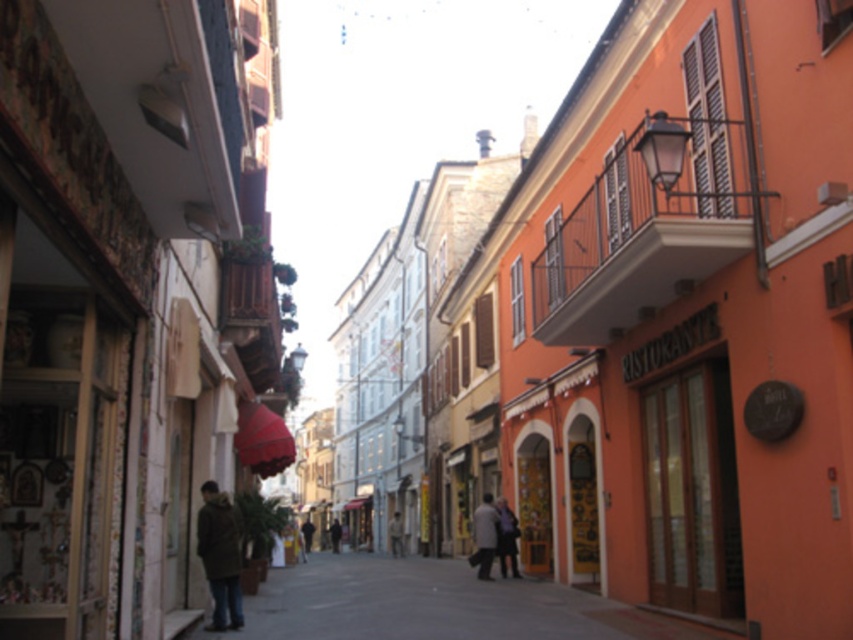
You are standing on the street looking at the orange building with the restaurant sign. There are two points marked on the building wall. The first point is at coordinate [514,531] and the second at [340,525]. Which point is closer to you?

The point at coordinate [514,531] is closer to you than the point at [340,525].

You are a delivery person standing on the street in front of the RISTORANTE. You need to deliver a package to the person wearing dark blue jeans at center and dark gray coat at center. Which item should you hand the package to first?

The dark blue jeans at center is above the dark gray coat at center, so you should hand the package to the dark blue jeans at center first as it is positioned higher up.

You are a delivery person who needs to place a package on the smooth concrete pavement at center. However, there is a light brown leather jacket at center in the way. Can you place the package there without moving the jacket?

The smooth concrete pavement at center is positioned over the light brown leather jacket at center, meaning the jacket is already on the pavement. Therefore, you cannot place the package there without moving the jacket.